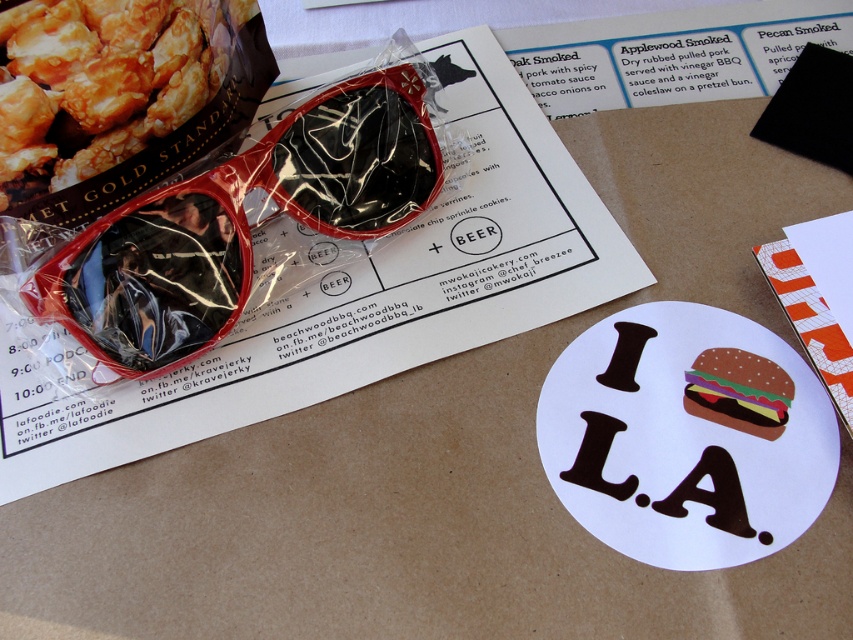
Question: Which object is positioned closest to the polka-dotted paper burger at center?

Choices:
 (A) golden crispy popcorn at upper left
 (B) shiny red plastic sunglasses at upper left

Answer: (B)

Question: Is shiny red plastic sunglasses at upper left wider than polka-dotted paper burger at center?

Choices:
 (A) no
 (B) yes

Answer: (B)

Question: Is golden crispy popcorn at upper left smaller than polka-dotted paper burger at center?

Choices:
 (A) yes
 (B) no

Answer: (B)

Question: Which object appears farthest from the camera in this image?

Choices:
 (A) golden crispy popcorn at upper left
 (B) shiny red plastic sunglasses at upper left

Answer: (B)

Question: Is shiny red plastic sunglasses at upper left to the left of golden crispy popcorn at upper left from the viewer's perspective?

Choices:
 (A) no
 (B) yes

Answer: (A)

Question: Which of the following is the farthest from the observer?

Choices:
 (A) (390, 227)
 (B) (108, 42)

Answer: (A)